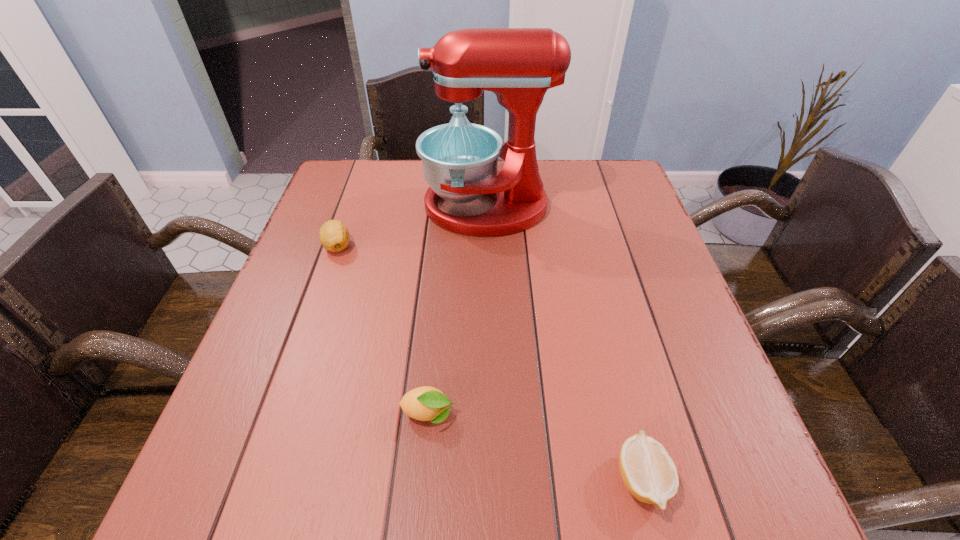
The width and height of the screenshot is (960, 540). Find the location of `mixer`. mixer is located at coordinates coord(460,159).

Where is `the leftmost lemon`? Image resolution: width=960 pixels, height=540 pixels. the leftmost lemon is located at coordinates (334, 236).

Locate an element on the screen. The image size is (960, 540). the farthest lemon is located at coordinates (334, 236).

I want to click on the second nearest object, so click(425, 403).

At what (x,y) coordinates should I click in order to perform the action: click on the second lemon from left to right. Please return your answer as a coordinate pair (x, y). This screenshot has height=540, width=960. Looking at the image, I should click on (425, 403).

Locate an element on the screen. The width and height of the screenshot is (960, 540). the rightmost object is located at coordinates (648, 472).

The height and width of the screenshot is (540, 960). What are the coordinates of `the nearest lemon` in the screenshot? It's located at (648, 472).

The image size is (960, 540). I want to click on blank area located 0.150m on the front-facing side of the mixer, so click(x=368, y=207).

This screenshot has width=960, height=540. I want to click on blank space located on the front-facing side of the mixer, so click(x=316, y=207).

What are the coordinates of `vacant space located on the front-facing side of the mixer` in the screenshot? It's located at (x=372, y=207).